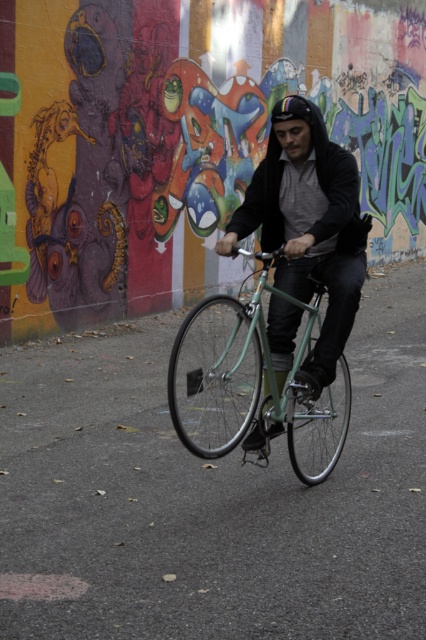
Does point (304, 205) come in front of point (218, 385)?

Yes, point (304, 205) is closer to viewer.

Does matte black jacket at center appear on the right side of metallic green bicycle at center?

Indeed, matte black jacket at center is positioned on the right side of metallic green bicycle at center.

Find the location of a particular element. Image resolution: width=426 pixels, height=640 pixels. matte black jacket at center is located at coordinates (308, 230).

In order to click on matte black jacket at center in this screenshot , I will do `click(308, 230)`.

Is multicolored graffiti wall at center below matte black jacket at center?

Actually, multicolored graffiti wall at center is above matte black jacket at center.

Does multicolored graffiti wall at center come in front of matte black jacket at center?

No, it is behind matte black jacket at center.

This screenshot has width=426, height=640. Identify the location of multicolored graffiti wall at center. (184, 140).

Does metallic green bicycle at center have a lesser height compared to rainbow reflective helmet at center?

Indeed, metallic green bicycle at center has a lesser height compared to rainbow reflective helmet at center.

Who is positioned more to the right, metallic green bicycle at center or rainbow reflective helmet at center?

From the viewer's perspective, rainbow reflective helmet at center appears more on the right side.

Locate an element on the screen. This screenshot has width=426, height=640. metallic green bicycle at center is located at coordinates (218, 369).

Identify the location of metallic green bicycle at center. (x=218, y=369).